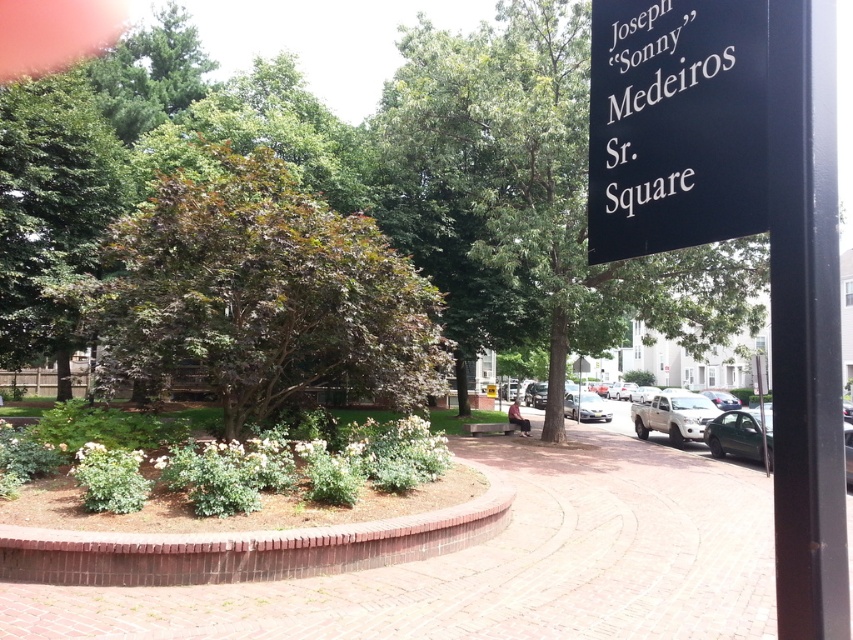
Between point (341, 584) and point (679, 422), which one is positioned in front?

Point (341, 584) is in front.

Is brick pavement at center to the right of silver metallic pickup truck at center-right from the viewer's perspective?

In fact, brick pavement at center is to the left of silver metallic pickup truck at center-right.

What do you see at coordinates (502, 563) in the screenshot? Image resolution: width=853 pixels, height=640 pixels. I see `brick pavement at center` at bounding box center [502, 563].

Where is `brick pavement at center`? The width and height of the screenshot is (853, 640). brick pavement at center is located at coordinates (502, 563).

Does point (310, 256) come closer to viewer compared to point (30, 163)?

Yes, it is in front of point (30, 163).

Which is more to the left, purple-leaved shrub at center-left or green leafy tree at left?

green leafy tree at left is more to the left.

Identify the location of purple-leaved shrub at center-left. (259, 294).

Image resolution: width=853 pixels, height=640 pixels. I want to click on purple-leaved shrub at center-left, so click(x=259, y=294).

Which is more to the left, black plastic sign at upper right or green leafy tree at left?

green leafy tree at left is more to the left.

Does point (751, 208) come in front of point (50, 280)?

Yes, point (751, 208) is closer to viewer.

At what (x,y) coordinates should I click in order to perform the action: click on black plastic sign at upper right. Please return your answer as a coordinate pair (x, y). The height and width of the screenshot is (640, 853). Looking at the image, I should click on (675, 124).